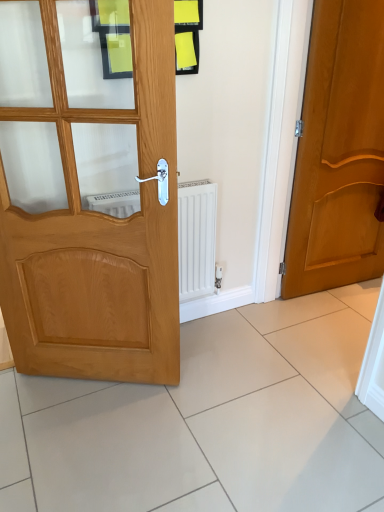
Question: Is light brown wood door at left, which is the 1th door from front to back, in front of or behind white glossy tile at lower right in the image?

Choices:
 (A) front
 (B) behind

Answer: (A)

Question: From a real-world perspective, relative to white glossy tile at lower right, is light brown wood door at left, the first door viewed from the left, vertically above or below?

Choices:
 (A) above
 (B) below

Answer: (A)

Question: Which is nearer to the light brown wood door at left, which is the 1th door from front to back?

Choices:
 (A) white glossy tile at lower right
 (B) matte wood door at right, acting as the 1th door starting from the back

Answer: (A)

Question: Based on their relative distances, which object is farther from the light brown wood door at left, placed as the second door when sorted from right to left?

Choices:
 (A) matte wood door at right, marked as the 2th door in a front-to-back arrangement
 (B) white glossy tile at lower right

Answer: (A)